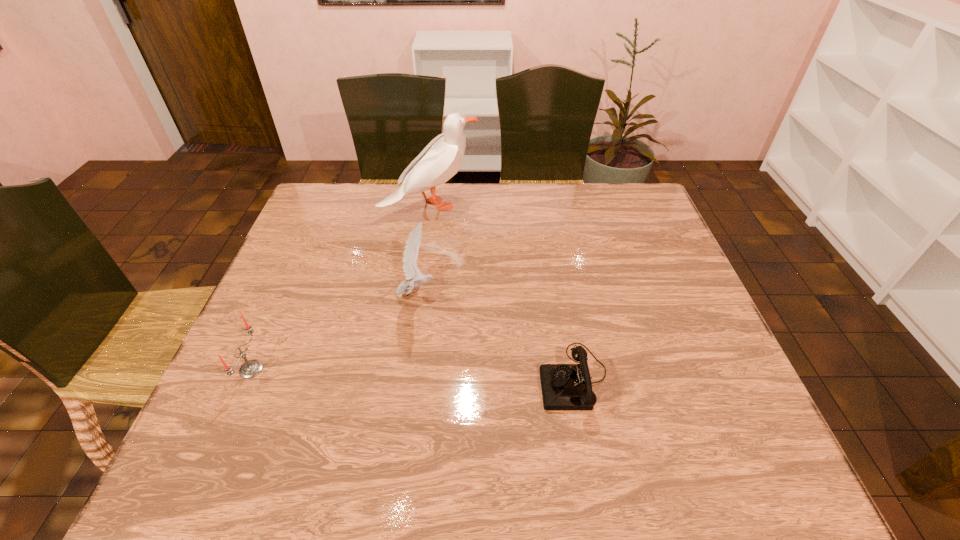
Select which object appears as the third closest to the candle. Please provide its 2D coordinates. Your answer should be formatted as a tuple, i.e. [(x, y)], where the tuple contains the x and y coordinates of a point satisfying the conditions above.

[(568, 387)]

At what (x,y) coordinates should I click in order to perform the action: click on object that stands as the closest to the rightmost object. Please return your answer as a coordinate pair (x, y). The width and height of the screenshot is (960, 540). Looking at the image, I should click on (410, 255).